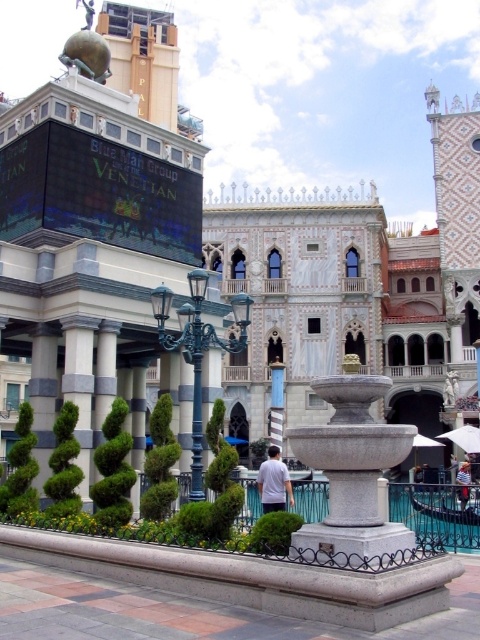
You are a guest at the Venetian resort and want to place a small bench between the granite fountain at center and the white fabric umbrella at center. The bench is 2 meters long. Will there be enough space between them to place the bench without moving either object?

The granite fountain at center and white fabric umbrella at center are 39.28 meters apart, so yes, there is more than enough space to place a 2 meter long bench between them without moving either object.

You are a guest at The Venetian and want to take a photo of the granite fountain at center and the white fabric umbrella at center. Which object is located to the left of the other?

The granite fountain at center is positioned on the left side of white fabric umbrella at center.